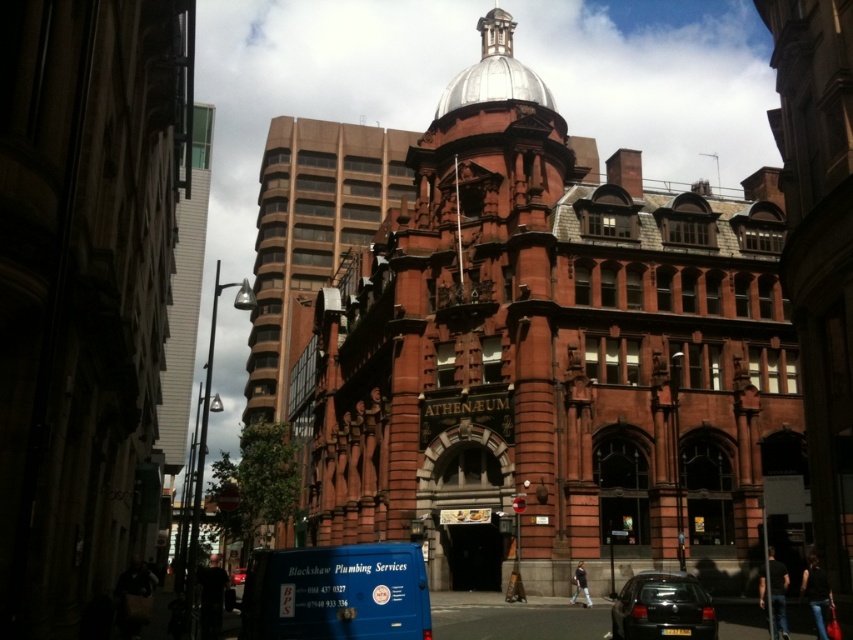
Is white glass tower at upper left shorter than shiny silver dome at center top?

Indeed, white glass tower at upper left has a lesser height compared to shiny silver dome at center top.

Does point (202, 228) lie in front of point (471, 76)?

No, (202, 228) is further to viewer.

Is point (199, 180) positioned in front of point (503, 26)?

That is False.

Identify the location of white glass tower at upper left. (184, 298).

Does white glass tower at upper left have a larger size compared to shiny black car at lower right?

Correct, white glass tower at upper left is larger in size than shiny black car at lower right.

Can you confirm if white glass tower at upper left is positioned to the left of shiny black car at lower right?

Yes, white glass tower at upper left is to the left of shiny black car at lower right.

Does point (178, 326) come in front of point (634, 605)?

No.

At what (x,y) coordinates should I click in order to perform the action: click on white glass tower at upper left. Please return your answer as a coordinate pair (x, y). This screenshot has height=640, width=853. Looking at the image, I should click on (184, 298).

Who is more forward, (706, 602) or (236, 582)?

Positioned in front is point (706, 602).

Which is behind, point (677, 630) or point (233, 579)?

The point (233, 579) is behind.

Between point (672, 573) and point (234, 580), which one is positioned in front?

Point (672, 573)

Where is `shiny black car at lower right`? shiny black car at lower right is located at coordinates (662, 609).